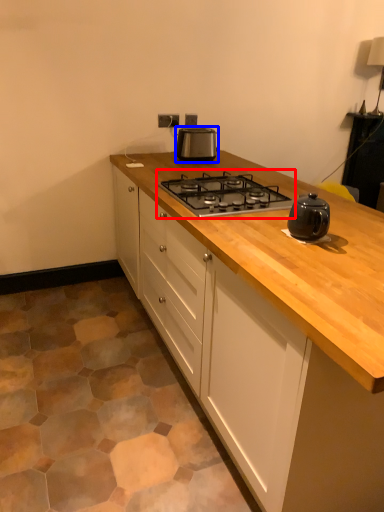
Question: Among these objects, which one is nearest to the camera, gas stove (highlighted by a red box) or kitchen appliance (highlighted by a blue box)?

Choices:
 (A) gas stove
 (B) kitchen appliance

Answer: (A)